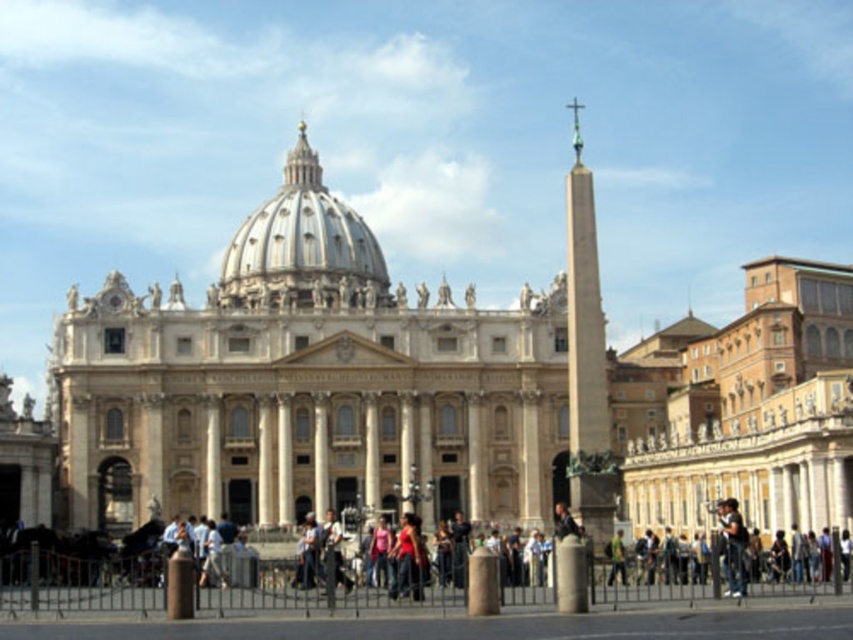
Who is positioned more to the left, white marble dome at center or dark blue jeans at lower right?

white marble dome at center is more to the left.

Consider the image. Can you confirm if white marble dome at center is thinner than dark blue jeans at lower right?

No.

Which is in front, point (242, 282) or point (730, 573)?

Point (730, 573) is in front.

Identify the location of white marble dome at center. (303, 246).